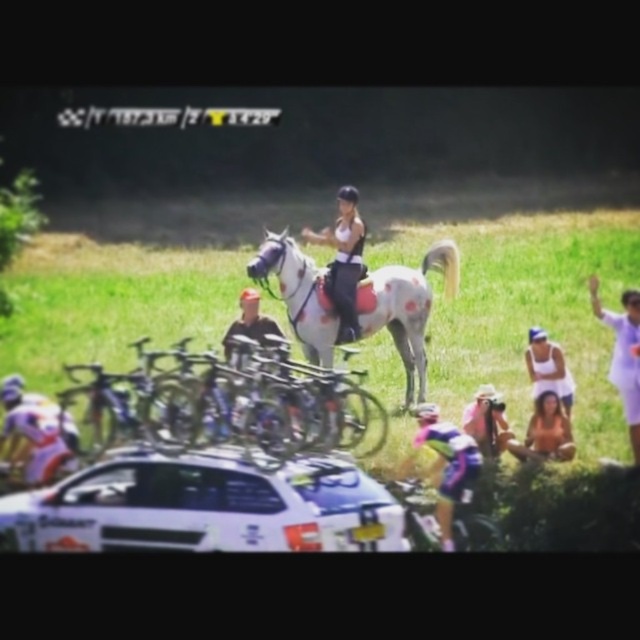
Question: Does pink fabric cyclist at lower center have a larger size compared to brown textured fabric at lower right?

Choices:
 (A) yes
 (B) no

Answer: (A)

Question: Considering the real-world distances, which object is farthest from the brown textured fabric at lower right?

Choices:
 (A) white speckled horse at center
 (B) pink fabric cyclist at lower center
 (C) silver metallic bicycle at center
 (D) white matte car at lower left

Answer: (D)

Question: Is white matte car at lower left closer to camera compared to silver metallic bicycle at center?

Choices:
 (A) no
 (B) yes

Answer: (B)

Question: Which is nearer to the pink fabric cyclist at lower center?

Choices:
 (A) brown textured fabric at lower right
 (B) silver metallic bicycle at center

Answer: (A)

Question: Based on their relative distances, which object is farther from the pink fabric cyclist at lower center?

Choices:
 (A) white speckled horse at center
 (B) white matte car at lower left

Answer: (A)

Question: Where is silver metallic bicycle at center located in relation to white speckled horse at center in the image?

Choices:
 (A) right
 (B) left

Answer: (B)